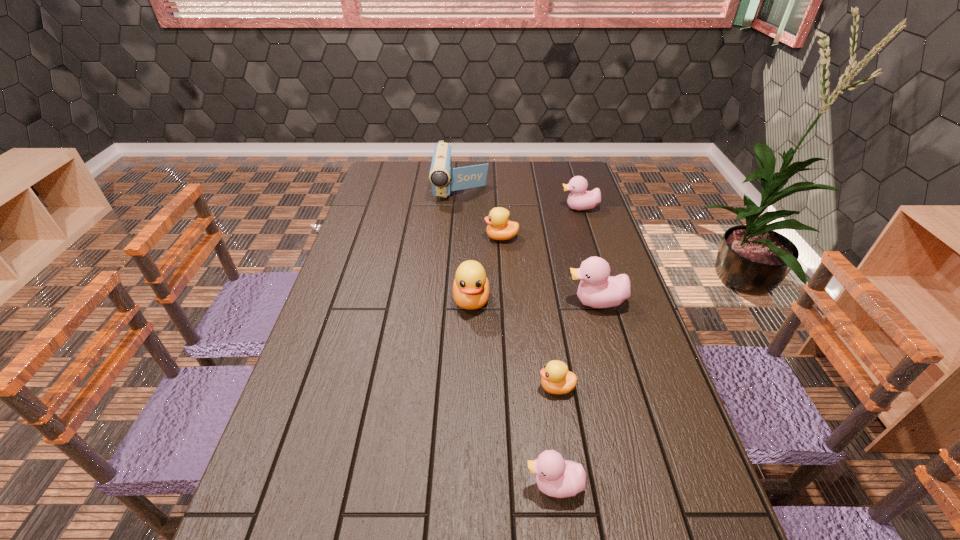
The height and width of the screenshot is (540, 960). What are the coordinates of `camcorder` in the screenshot? It's located at (440, 175).

You are a GUI agent. You are given a task and a screenshot of the screen. Output one action in this format:
    pyautogui.click(x=<x>, y=<y>)
    Task: Click on the second nearest pink duckling
    
    Given the screenshot: What is the action you would take?
    pyautogui.click(x=597, y=289)

Locate an element on the screen. the biggest yellow duckling is located at coordinates (471, 288).

Where is `the second biggest pink duckling`? This screenshot has width=960, height=540. the second biggest pink duckling is located at coordinates (579, 199).

Identify the location of the farthest pink duckling. (579, 199).

What are the coordinates of `the farthest yellow duckling` in the screenshot? It's located at (499, 228).

Locate an element on the screen. This screenshot has height=540, width=960. the second farthest duckling is located at coordinates (499, 228).

Locate an element on the screen. The width and height of the screenshot is (960, 540). the nearest pink duckling is located at coordinates (556, 477).

Image resolution: width=960 pixels, height=540 pixels. In order to click on the smallest pink duckling in this screenshot , I will do `click(556, 477)`.

Identify the location of the second nearest object. This screenshot has width=960, height=540. (556, 379).